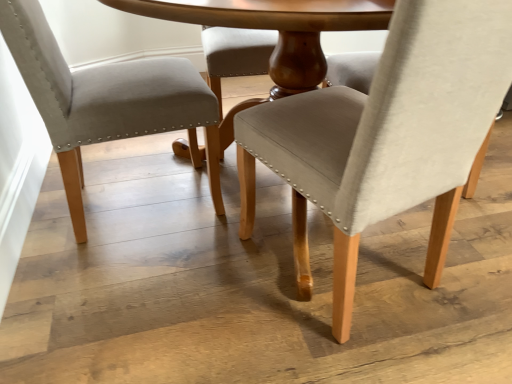
This screenshot has width=512, height=384. Find the location of `free space in front of beige fabric chair at left, the first chair positioned from the left`. free space in front of beige fabric chair at left, the first chair positioned from the left is located at coordinates (128, 284).